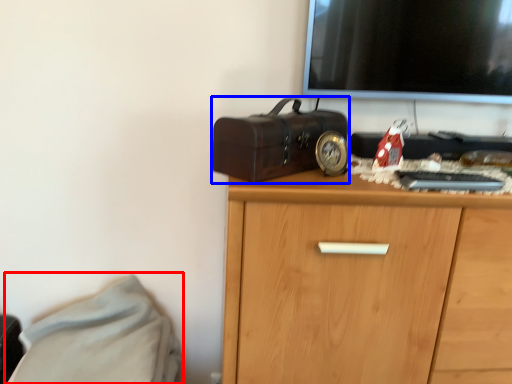
Question: Which object is further to the camera taking this photo, bed (highlighted by a red box) or suitcase (highlighted by a blue box)?

Choices:
 (A) bed
 (B) suitcase

Answer: (A)